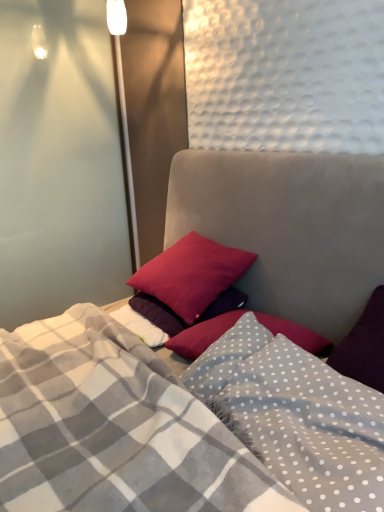
Question: Is velvet-like pillows at center at the back of matte red pillow at center, arranged as the second pillow when ordered from the bottom?

Choices:
 (A) no
 (B) yes

Answer: (B)

Question: Does matte red pillow at center, arranged as the second pillow when ordered from the bottom, lie in front of velvet-like pillows at center?

Choices:
 (A) no
 (B) yes

Answer: (A)

Question: Considering the relative sizes of matte red pillow at center, which is the 1th pillow from top to bottom, and velvet-like pillows at center in the image provided, is matte red pillow at center, which is the 1th pillow from top to bottom, wider than velvet-like pillows at center?

Choices:
 (A) no
 (B) yes

Answer: (A)

Question: Are matte red pillow at center, which is the 1th pillow from top to bottom, and velvet-like pillows at center far apart?

Choices:
 (A) no
 (B) yes

Answer: (A)

Question: Can you confirm if matte red pillow at center, which is the 1th pillow from top to bottom, is bigger than velvet-like pillows at center?

Choices:
 (A) yes
 (B) no

Answer: (B)

Question: Is gray polka dot blanket at center spatially inside transparent glass door at left, or outside of it?

Choices:
 (A) outside
 (B) inside

Answer: (A)

Question: In terms of width, does gray polka dot blanket at center look wider or thinner when compared to transparent glass door at left?

Choices:
 (A) wide
 (B) thin

Answer: (B)

Question: Considering the positions of gray polka dot blanket at center and transparent glass door at left in the image, is gray polka dot blanket at center bigger or smaller than transparent glass door at left?

Choices:
 (A) big
 (B) small

Answer: (B)

Question: From their relative heights in the image, would you say gray polka dot blanket at center is taller or shorter than transparent glass door at left?

Choices:
 (A) short
 (B) tall

Answer: (A)

Question: Visually, is matte red pillow at center, which is the 1th pillow from top to bottom, positioned to the left or to the right of velvet-like pillows at center?

Choices:
 (A) right
 (B) left

Answer: (A)

Question: From a real-world perspective, is matte red pillow at center, which is the 1th pillow from top to bottom, above or below velvet-like pillows at center?

Choices:
 (A) below
 (B) above

Answer: (B)

Question: Considering the positions of matte red pillow at center, which is the 1th pillow from top to bottom, and velvet-like pillows at center in the image, is matte red pillow at center, which is the 1th pillow from top to bottom, taller or shorter than velvet-like pillows at center?

Choices:
 (A) tall
 (B) short

Answer: (B)

Question: Considering the positions of matte red pillow at center, arranged as the second pillow when ordered from the bottom, and velvet-like pillows at center in the image, is matte red pillow at center, arranged as the second pillow when ordered from the bottom, wider or thinner than velvet-like pillows at center?

Choices:
 (A) wide
 (B) thin

Answer: (B)

Question: From a real-world perspective, is gray polka dot blanket at center above or below velvet-like pillows at center?

Choices:
 (A) above
 (B) below

Answer: (B)

Question: Considering the relative positions of gray polka dot blanket at center and velvet-like pillows at center in the image provided, is gray polka dot blanket at center to the left or to the right of velvet-like pillows at center?

Choices:
 (A) left
 (B) right

Answer: (B)